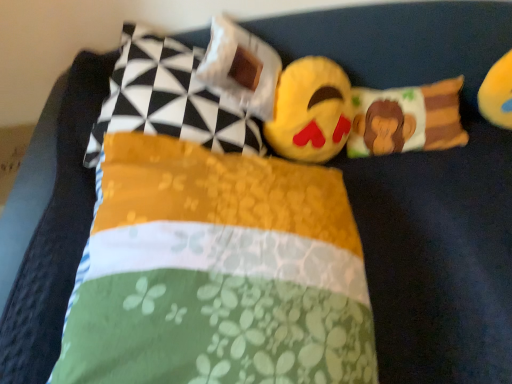
Question: Can you confirm if yellow plush toy at upper right, acting as the 2th toy starting from the left, is shorter than fluffy fabric monkey pillow at center, which ranks as the 1th pillow in right-to-left order?

Choices:
 (A) no
 (B) yes

Answer: (A)

Question: Does yellow plush toy at upper right, acting as the 2th toy starting from the left, lie behind fluffy fabric monkey pillow at center, which ranks as the 1th pillow in right-to-left order?

Choices:
 (A) no
 (B) yes

Answer: (A)

Question: Is fluffy fabric monkey pillow at center, which ranks as the 1th pillow in right-to-left order, completely or partially inside yellow plush toy at upper right, acting as the 2th toy starting from the left?

Choices:
 (A) no
 (B) yes

Answer: (A)

Question: Is fluffy fabric monkey pillow at center, arranged as the fourth pillow when viewed from the left, at the back of yellow plush toy at upper right, which appears as the 1th toy when viewed from the right?

Choices:
 (A) yes
 (B) no

Answer: (B)

Question: From a real-world perspective, is yellow plush toy at upper right, which appears as the 1th toy when viewed from the right, positioned over fluffy fabric monkey pillow at center, which ranks as the 1th pillow in right-to-left order, based on gravity?

Choices:
 (A) yes
 (B) no

Answer: (A)

Question: Relative to fluffy fabric monkey pillow at center, arranged as the fourth pillow when viewed from the left, is soft plush emoji at center, acting as the second toy starting from the right, in front or behind?

Choices:
 (A) behind
 (B) front

Answer: (B)

Question: From the image's perspective, is soft plush emoji at center, acting as the second toy starting from the right, positioned above or below fluffy fabric monkey pillow at center, arranged as the fourth pillow when viewed from the left?

Choices:
 (A) below
 (B) above

Answer: (A)

Question: Is point (309, 150) positioned closer to the camera than point (400, 107)?

Choices:
 (A) closer
 (B) farther

Answer: (A)

Question: Which is correct: soft plush emoji at center, acting as the second toy starting from the right, is inside fluffy fabric monkey pillow at center, which ranks as the 1th pillow in right-to-left order, or outside of it?

Choices:
 (A) inside
 (B) outside

Answer: (B)

Question: Is white fabric pillow at upper center, the second pillow positioned from the left, inside the boundaries of floral fabric pillow at center, which is counted as the third pillow, starting from the left, or outside?

Choices:
 (A) inside
 (B) outside

Answer: (B)

Question: Based on their positions, is white fabric pillow at upper center, positioned as the third pillow in right-to-left order, located to the left or right of floral fabric pillow at center, which is counted as the third pillow, starting from the left?

Choices:
 (A) left
 (B) right

Answer: (A)

Question: Is white fabric pillow at upper center, positioned as the third pillow in right-to-left order, in front of or behind floral fabric pillow at center, marked as the second pillow in a right-to-left arrangement, in the image?

Choices:
 (A) front
 (B) behind

Answer: (B)

Question: Looking at the image, does white fabric pillow at upper center, the second pillow positioned from the left, seem bigger or smaller compared to floral fabric pillow at center, which is counted as the third pillow, starting from the left?

Choices:
 (A) small
 (B) big

Answer: (A)

Question: Is soft plush emoji at center, the first toy when ordered from left to right, taller or shorter than white fabric pillow at upper center, the second pillow positioned from the left?

Choices:
 (A) short
 (B) tall

Answer: (B)

Question: Is soft plush emoji at center, the first toy when ordered from left to right, bigger or smaller than white fabric pillow at upper center, the second pillow positioned from the left?

Choices:
 (A) small
 (B) big

Answer: (B)